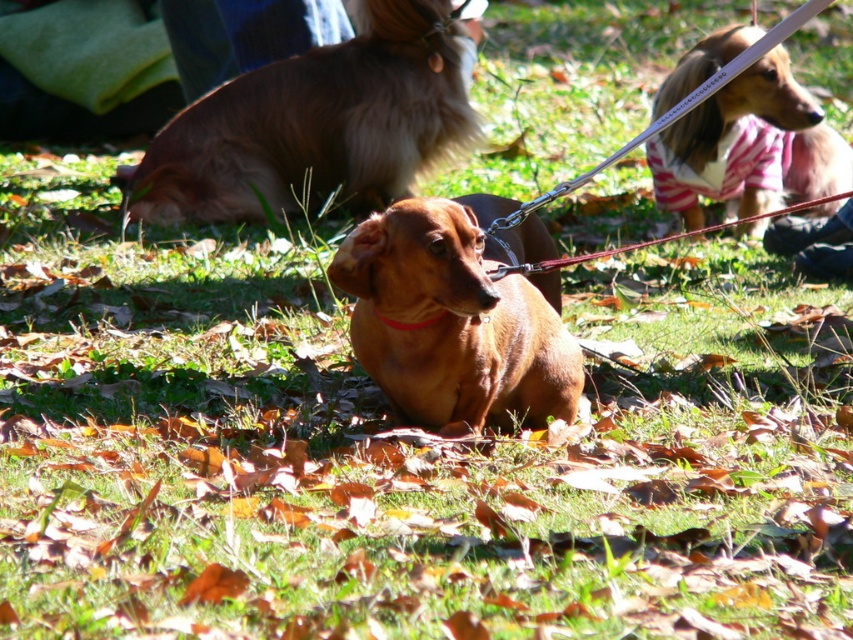
Is brown shiny dog at center to the right of brown fur dog at center from the viewer's perspective?

In fact, brown shiny dog at center is to the left of brown fur dog at center.

The width and height of the screenshot is (853, 640). Find the location of `brown shiny dog at center`. brown shiny dog at center is located at coordinates (456, 317).

Identify the location of brown shiny dog at center. The image size is (853, 640). (456, 317).

In the scene shown: Is brown fluffy dog at upper center smaller than brown shiny dog at center?

No.

Does brown fluffy dog at upper center appear under brown shiny dog at center?

No, brown fluffy dog at upper center is not below brown shiny dog at center.

Between point (405, 38) and point (387, 333), which one is positioned in front?

Point (387, 333)

This screenshot has height=640, width=853. I want to click on brown fluffy dog at upper center, so click(x=317, y=124).

Is brown fluffy dog at upper center shorter than brown leather collar at center?

In fact, brown fluffy dog at upper center may be taller than brown leather collar at center.

Is point (193, 129) less distant than point (445, 312)?

That is False.

Is point (218, 113) less distant than point (390, 324)?

No.

Identify the location of brown fluffy dog at upper center. (317, 124).